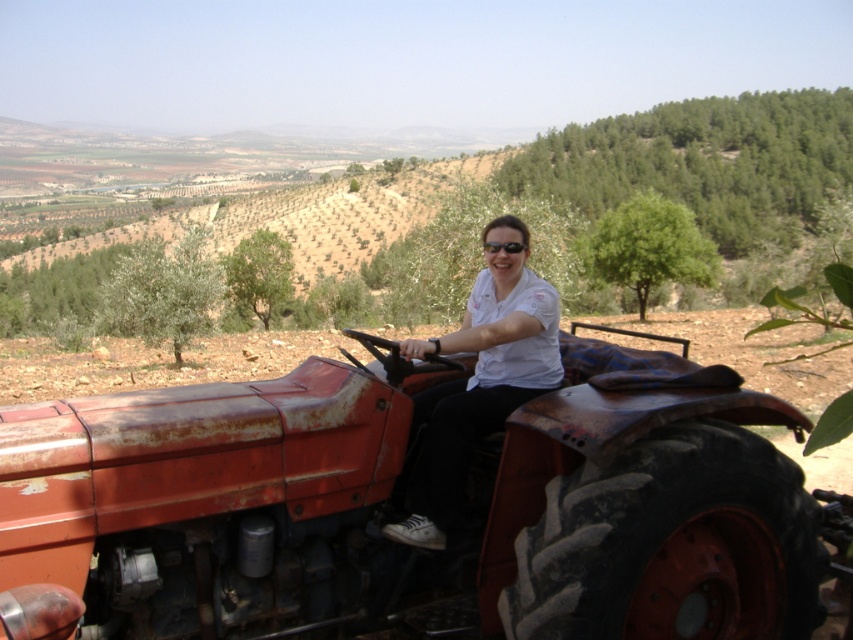
Based on the photo, who is positioned more to the right, rusty metal tractor at center or black plastic sunglasses at center?

black plastic sunglasses at center is more to the right.

Who is shorter, rusty metal tractor at center or black plastic sunglasses at center?

Standing shorter between the two is black plastic sunglasses at center.

Is point (606, 436) farther from viewer compared to point (512, 248)?

No, it is in front of (512, 248).

Identify the location of rusty metal tractor at center. This screenshot has width=853, height=640. (399, 508).

Between point (442, 528) and point (517, 250), which one is positioned in front?

Positioned in front is point (442, 528).

Who is more distant from viewer, (474, 385) or (517, 250)?

The point (474, 385) is more distant.

The height and width of the screenshot is (640, 853). Find the location of `white matte shirt at center`. white matte shirt at center is located at coordinates (479, 381).

What do you see at coordinates (399, 508) in the screenshot?
I see `rusty metal tractor at center` at bounding box center [399, 508].

Is rusty metal tractor at center bigger than white matte shirt at center?

Indeed, rusty metal tractor at center has a larger size compared to white matte shirt at center.

Who is more forward, (613, 396) or (454, 484)?

Point (613, 396) is in front.

You are a GUI agent. You are given a task and a screenshot of the screen. Output one action in this format:
    pyautogui.click(x=<x>, y=<y>)
    Task: Click on the rusty metal tractor at center
    Image resolution: width=853 pixels, height=640 pixels.
    Given the screenshot: What is the action you would take?
    pyautogui.click(x=399, y=508)